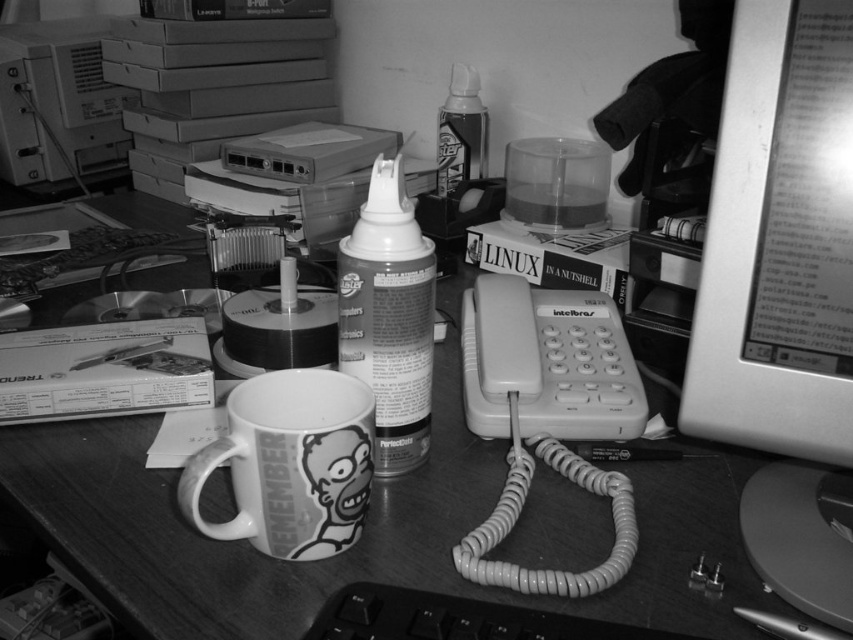
Question: Does white ceramic mug at center lie behind black plastic keyboard at lower center?

Choices:
 (A) no
 (B) yes

Answer: (B)

Question: Which point is closer to the camera?

Choices:
 (A) (403, 262)
 (B) (364, 465)

Answer: (B)

Question: Is white ceramic mug at center wider than satin white spray can at center?

Choices:
 (A) yes
 (B) no

Answer: (A)

Question: Which point is farther to the camera?

Choices:
 (A) metallic silver monitor at right
 (B) black plastic keyboard at lower center
 (C) metallic gray monitor at right

Answer: (A)

Question: Which of the following is the farthest from the observer?

Choices:
 (A) matte plastic desktop computer at upper left
 (B) metallic gray monitor at right

Answer: (A)

Question: Is white ceramic mug at center closer to the viewer compared to satin white spray can at center?

Choices:
 (A) yes
 (B) no

Answer: (A)